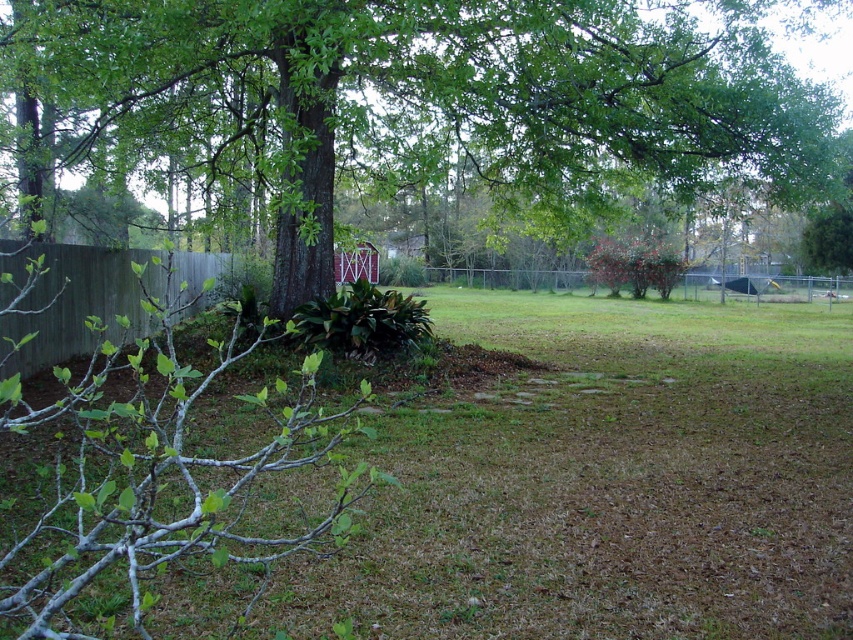
Question: Among these objects, which one is nearest to the camera?

Choices:
 (A) green leafy tree at center
 (B) gray wood fence at left
 (C) metallic chain-link fence at center-right

Answer: (A)

Question: Considering the relative positions of green grass at lower center and gray wood fence at left in the image provided, where is green grass at lower center located with respect to gray wood fence at left?

Choices:
 (A) right
 (B) left

Answer: (A)

Question: Does green grass at lower center appear on the right side of gray wood fence at left?

Choices:
 (A) no
 (B) yes

Answer: (B)

Question: Which point is farther to the camera?

Choices:
 (A) (827, 292)
 (B) (645, 627)
 (C) (564, 125)

Answer: (A)

Question: In this image, where is green grass at lower center located relative to metallic chain-link fence at center-right?

Choices:
 (A) right
 (B) left

Answer: (B)

Question: Which object is farther from the camera taking this photo?

Choices:
 (A) green leafy tree at center
 (B) metallic chain-link fence at center-right
 (C) gray wood fence at left
 (D) green grass at lower center

Answer: (B)